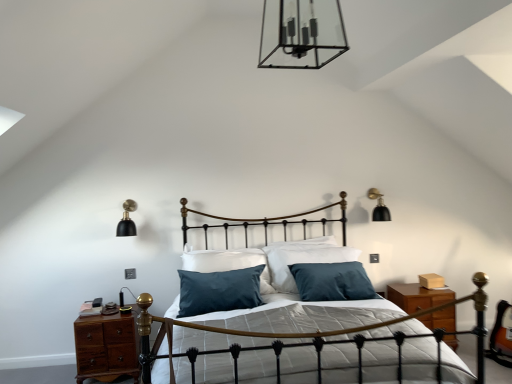
Question: Can you confirm if clear glass chandelier at upper center, which ranks as the third light fixture in back-to-front order, is smaller than gold wrought iron bed frame at center?

Choices:
 (A) no
 (B) yes

Answer: (B)

Question: Could gold wrought iron bed frame at center be considered to be inside clear glass chandelier at upper center, the second light fixture positioned from the right?

Choices:
 (A) no
 (B) yes

Answer: (A)

Question: Is clear glass chandelier at upper center, acting as the 2th light fixture starting from the left, outside gold wrought iron bed frame at center?

Choices:
 (A) no
 (B) yes

Answer: (B)

Question: From a real-world perspective, does clear glass chandelier at upper center, which ranks as the third light fixture in back-to-front order, sit lower than gold wrought iron bed frame at center?

Choices:
 (A) yes
 (B) no

Answer: (B)

Question: Is clear glass chandelier at upper center, the second light fixture positioned from the right, taller than gold wrought iron bed frame at center?

Choices:
 (A) yes
 (B) no

Answer: (B)

Question: Is gold wrought iron bed frame at center spatially inside clear glass chandelier at upper center, which ranks as the third light fixture in back-to-front order, or outside of it?

Choices:
 (A) outside
 (B) inside

Answer: (A)

Question: Based on their sizes in the image, would you say gold wrought iron bed frame at center is bigger or smaller than clear glass chandelier at upper center, arranged as the 3th light fixture when ordered from the bottom?

Choices:
 (A) big
 (B) small

Answer: (A)

Question: In terms of width, does gold wrought iron bed frame at center look wider or thinner when compared to clear glass chandelier at upper center, placed as the first light fixture when sorted from top to bottom?

Choices:
 (A) wide
 (B) thin

Answer: (A)

Question: Considering their positions, is gold wrought iron bed frame at center located in front of or behind clear glass chandelier at upper center, placed as the first light fixture when sorted from top to bottom?

Choices:
 (A) front
 (B) behind

Answer: (B)

Question: From the image's perspective, is black matte wall sconce at left, arranged as the first light fixture when viewed from the left, above or below clear glass chandelier at upper center, the second light fixture positioned from the right?

Choices:
 (A) above
 (B) below

Answer: (B)

Question: In the image, is black matte wall sconce at left, acting as the second light fixture starting from the front, on the left side or the right side of clear glass chandelier at upper center, placed as the first light fixture when sorted from top to bottom?

Choices:
 (A) right
 (B) left

Answer: (B)

Question: Considering the positions of black matte wall sconce at left, placed as the first light fixture when sorted from bottom to top, and clear glass chandelier at upper center, the second light fixture positioned from the right, in the image, is black matte wall sconce at left, placed as the first light fixture when sorted from bottom to top, taller or shorter than clear glass chandelier at upper center, the second light fixture positioned from the right,?

Choices:
 (A) short
 (B) tall

Answer: (A)

Question: Is black matte wall sconce at left, which ranks as the second light fixture in back-to-front order, inside or outside of clear glass chandelier at upper center, which ranks as the third light fixture in back-to-front order?

Choices:
 (A) outside
 (B) inside

Answer: (A)

Question: Does point (373, 221) appear closer or farther from the camera than point (271, 380)?

Choices:
 (A) farther
 (B) closer

Answer: (A)

Question: Considering their positions, is black matte wall sconce at upper right, which is the third light fixture in left-to-right order, located in front of or behind gold wrought iron bed frame at center?

Choices:
 (A) behind
 (B) front

Answer: (A)